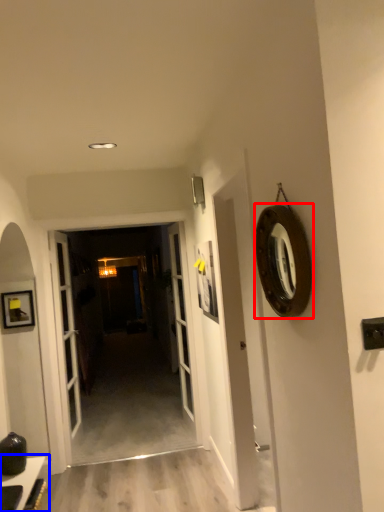
Question: Which object is closer to the camera taking this photo, oval (highlighted by a red box) or table (highlighted by a blue box)?

Choices:
 (A) oval
 (B) table

Answer: (A)